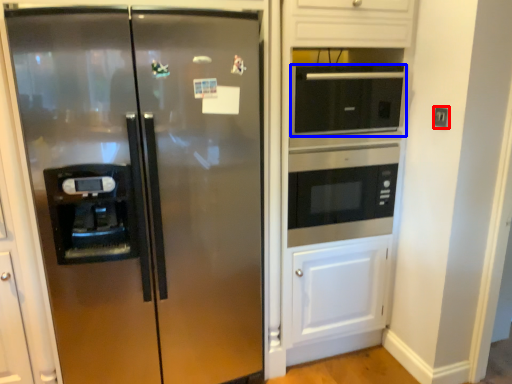
Question: Which object appears closest to the camera in this image, electric outlet (highlighted by a red box) or microwave oven (highlighted by a blue box)?

Choices:
 (A) electric outlet
 (B) microwave oven

Answer: (B)